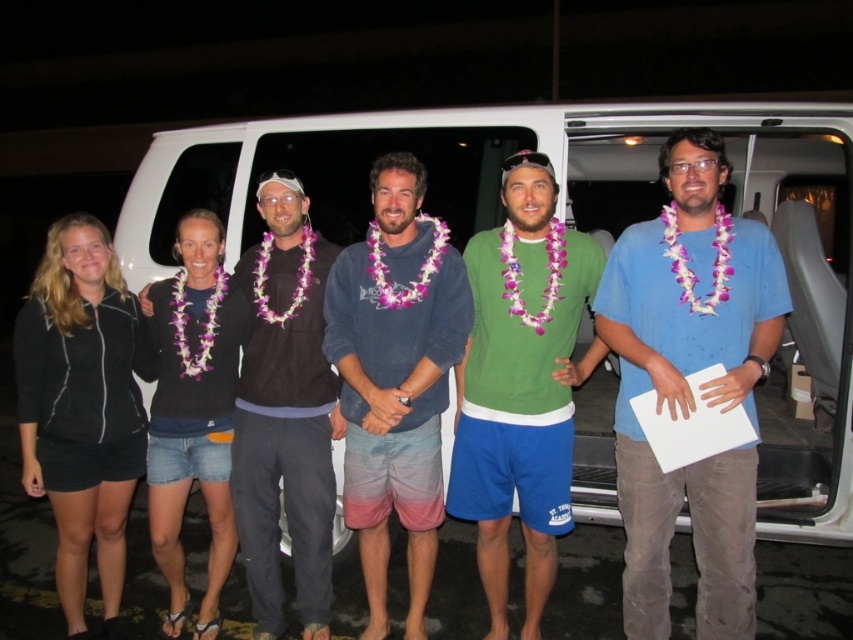
The image size is (853, 640). Identify the location of blue cotton shirt at center. (688, 385).

Is point (743, 524) closer to viewer compared to point (518, 193)?

That is True.

Who is more forward, (728,449) or (531,292)?

Point (728,449) is in front.

At what (x,y) coordinates should I click in order to perform the action: click on blue cotton shirt at center. Please return your answer as a coordinate pair (x, y). Image resolution: width=853 pixels, height=640 pixels. Looking at the image, I should click on [688, 385].

This screenshot has width=853, height=640. Identify the location of blue cotton shirt at center. (688, 385).

Can you confirm if blue cotton shirt at center is positioned to the right of black sweater at center?

Indeed, blue cotton shirt at center is positioned on the right side of black sweater at center.

In order to click on blue cotton shirt at center in this screenshot , I will do `click(688, 385)`.

Is white matte van at center thinner than blue cotton shirt at center?

Incorrect, white matte van at center's width is not less than blue cotton shirt at center's.

At what (x,y) coordinates should I click in order to perform the action: click on white matte van at center. Please return your answer as a coordinate pair (x, y). The width and height of the screenshot is (853, 640). Looking at the image, I should click on (498, 180).